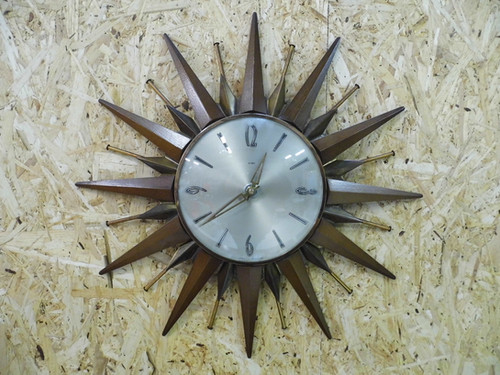
What are the coordinates of `white spots in wall` in the screenshot? It's located at (144, 323), (81, 269), (79, 194), (106, 163), (73, 110), (414, 155), (421, 327).